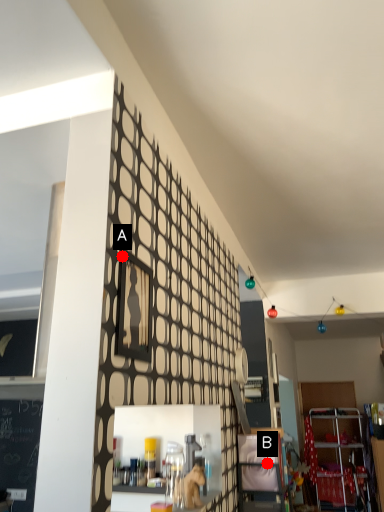
Question: Two points are circled on the image, labeled by A and B beside each circle. Among these points, which one is nearest to the camera?

Choices:
 (A) A is closer
 (B) B is closer

Answer: (A)